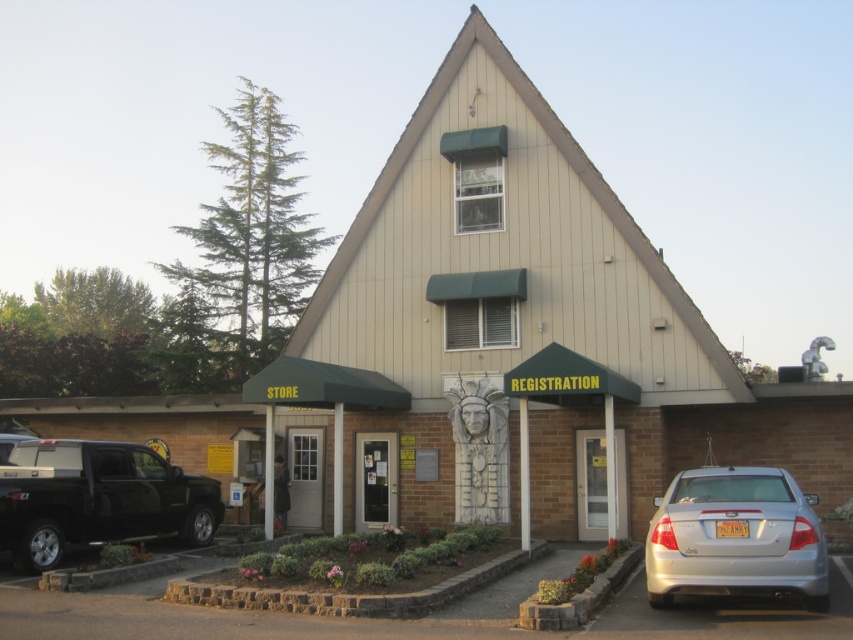
Question: Among these points, which one is nearest to the camera?

Choices:
 (A) (7, 477)
 (B) (728, 538)

Answer: (B)

Question: Can you confirm if silver metallic sedan at lower right is thinner than shiny black truck at lower left?

Choices:
 (A) no
 (B) yes

Answer: (B)

Question: Does silver metallic sedan at lower right appear over shiny black truck at lower left?

Choices:
 (A) no
 (B) yes

Answer: (B)

Question: Is silver metallic sedan at lower right bigger than shiny black truck at lower left?

Choices:
 (A) no
 (B) yes

Answer: (A)